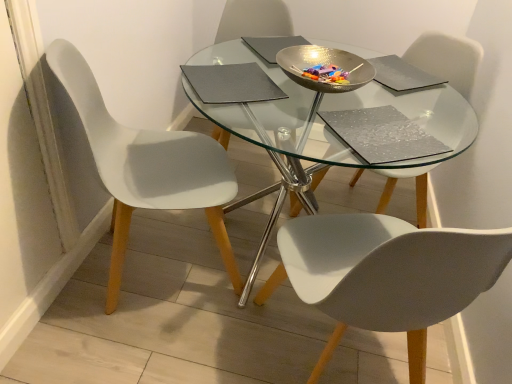
I want to click on free space in front of white matte chair at left, which is the 1th chair in left-to-right order, so click(x=131, y=347).